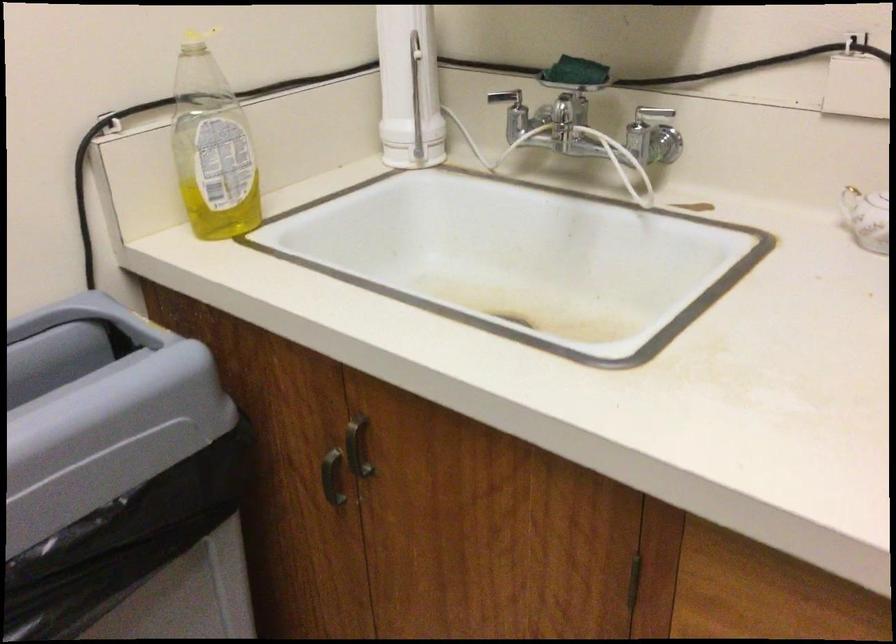
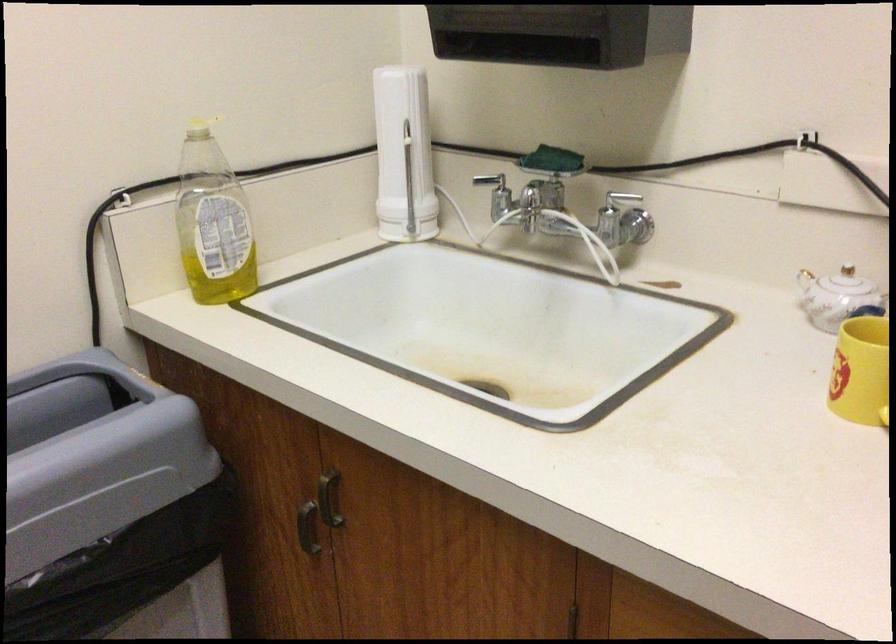
Locate, in the second image, the point that corresponds to point 355,439 in the first image.

(328, 498)